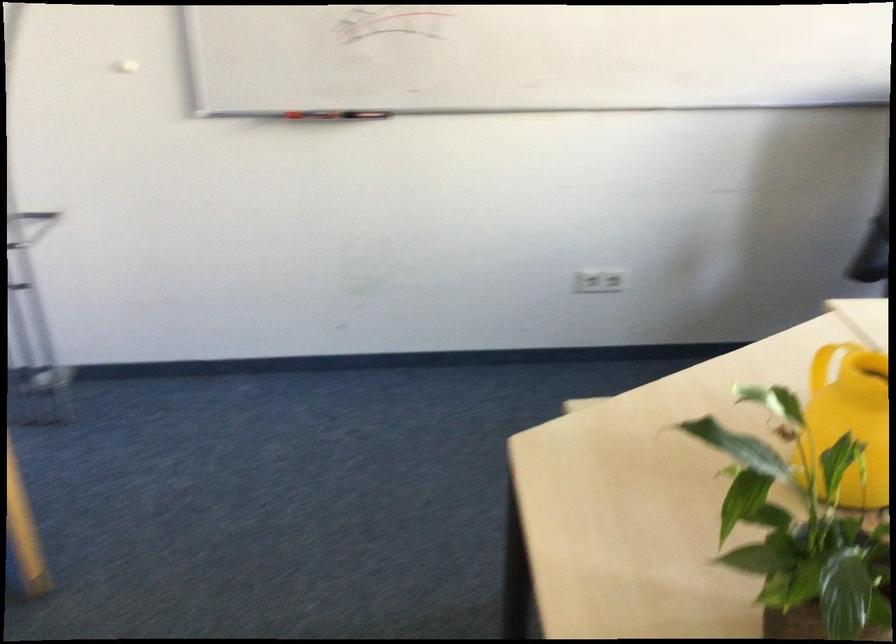
Where would you lift the brown plant pot? Please return your answer as a coordinate pair (x, y).

(815, 621)